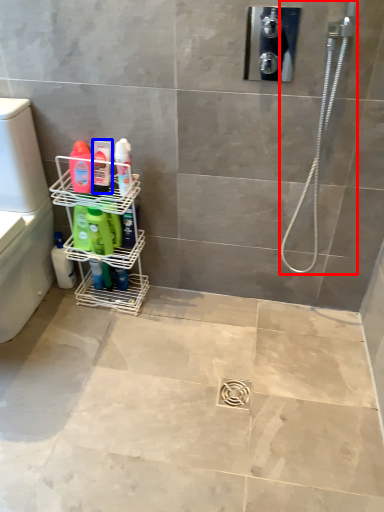
Question: Which point is closer to the camera, shower (highlighted by a red box) or toiletry (highlighted by a blue box)?

Choices:
 (A) shower
 (B) toiletry

Answer: (A)